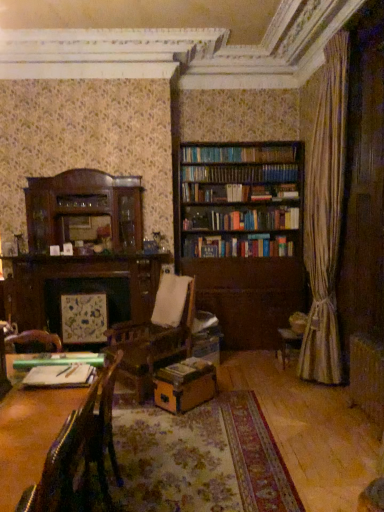
Identify the location of blank space situated above green matte ruler at lower left, positioned as the first book in top-to-bottom order (from a real-world perspective). (64, 365).